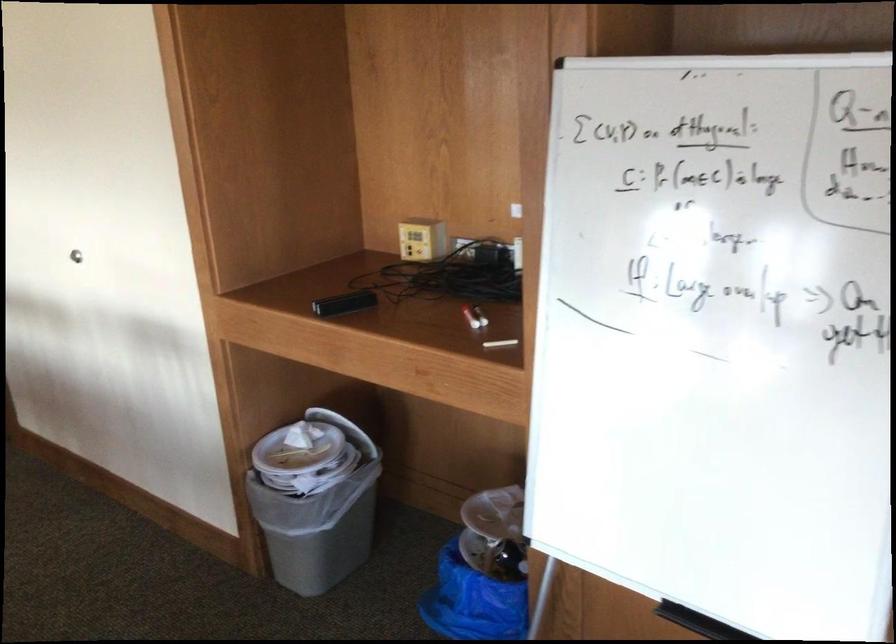
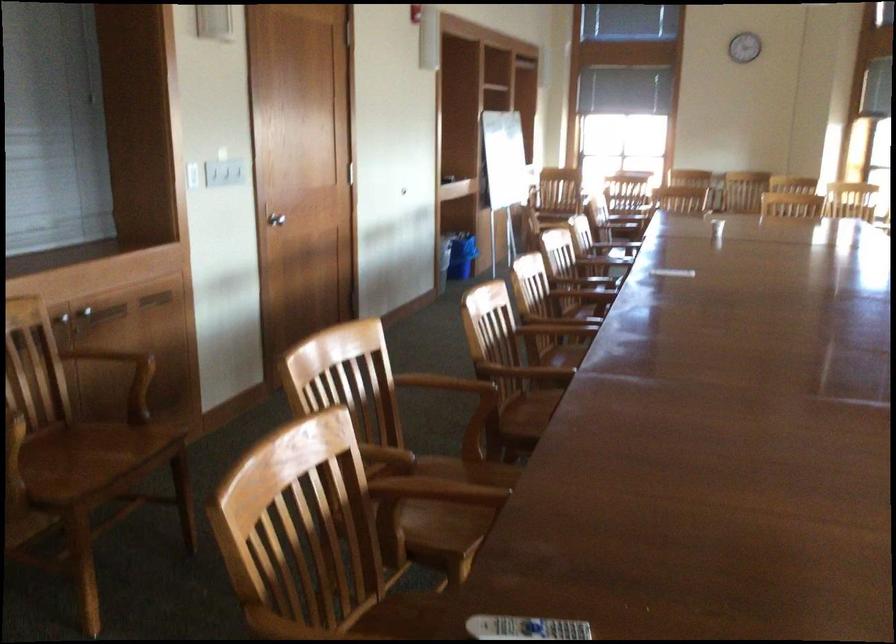
Question: I am providing you with two images of the same scene from different viewpoints. After the viewpoint changes to image2, which objects are now occluded?

Choices:
 (A) cabinet handle
 (B) machine paper slot
 (C) white light switch
 (D) grey trash can

Answer: (D)